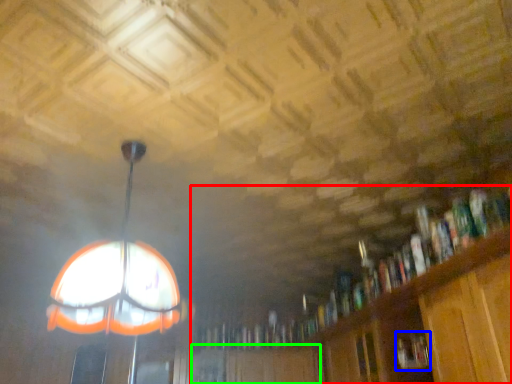
Question: Considering the real-world distances, which object is closest to bookcase (highlighted by a red box)? book (highlighted by a blue box) or cabinetry (highlighted by a green box).

Choices:
 (A) book
 (B) cabinetry

Answer: (B)